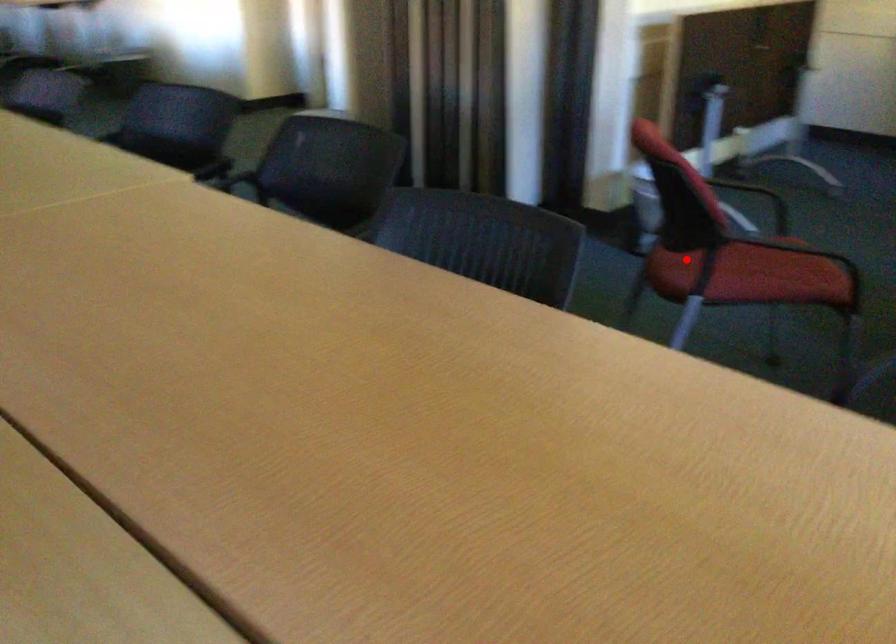
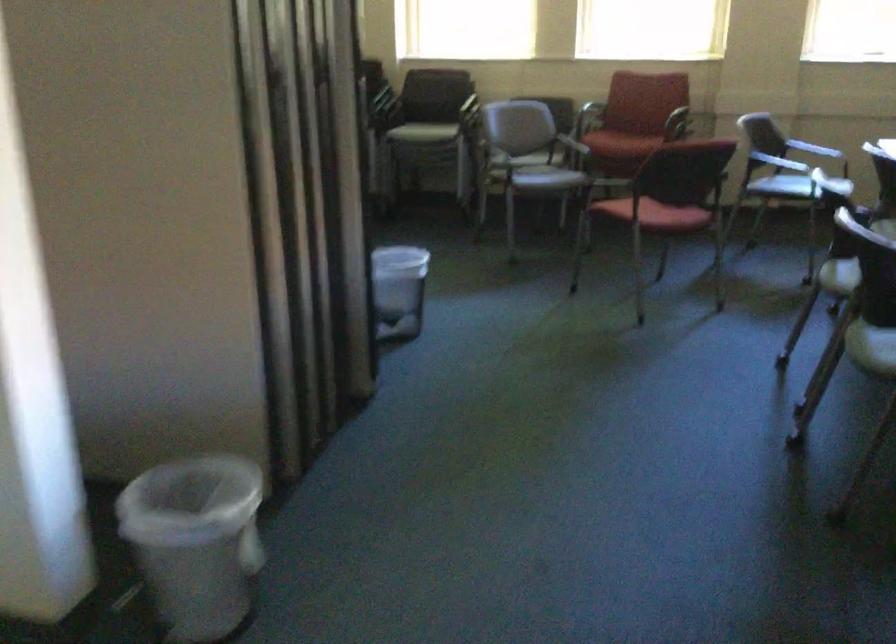
The point at the highlighted location is marked in the first image. Where is the corresponding point in the second image?

(660, 214)